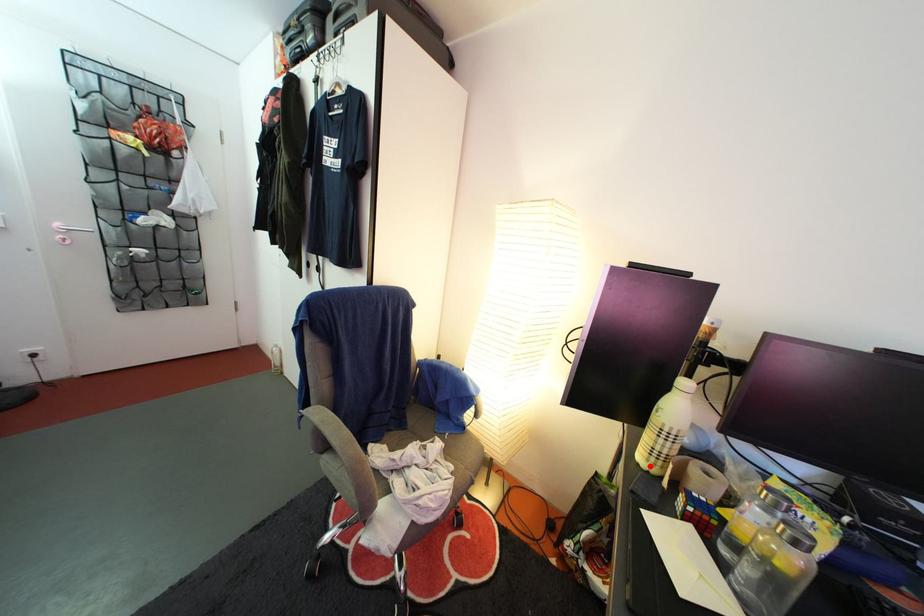
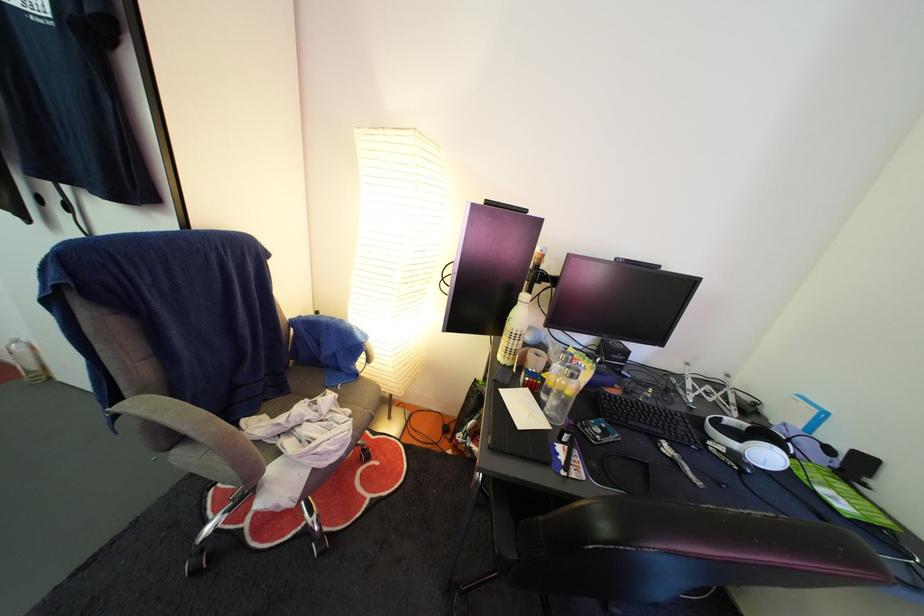
Locate, in the second image, the point that corresponds to the highlighted location in the first image.

(509, 365)